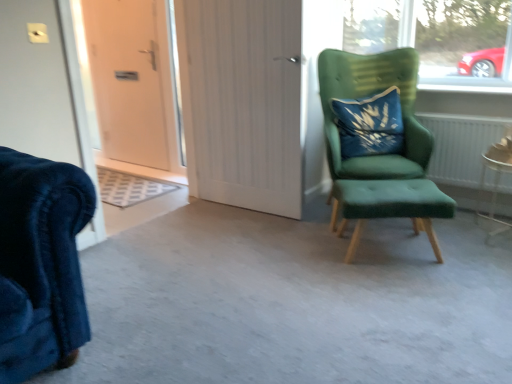
Locate an element on the screen. vacant space in white wood door at center, the second door positioned from the left (from a real-world perspective) is located at coordinates (246, 204).